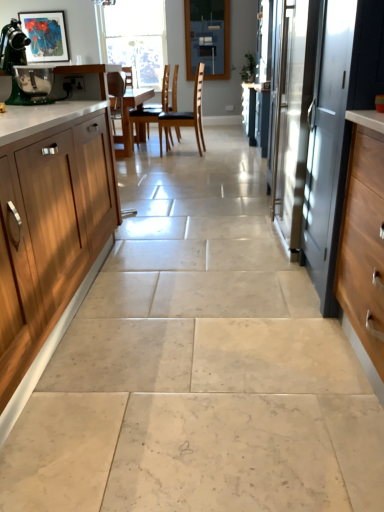
Question: Which direction should I rotate to look at brown leather chair at center, the 2th chair positioned from the right, — up or down?

Choices:
 (A) up
 (B) down

Answer: (A)

Question: Should I look upward or downward to see matte acrylic painting at upper left?

Choices:
 (A) down
 (B) up

Answer: (B)

Question: From a real-world perspective, is black leather chair at center, placed as the 2th chair when sorted from left to right, beneath blue glass window screen at upper center?

Choices:
 (A) yes
 (B) no

Answer: (A)

Question: From a real-world perspective, is black leather chair at center, placed as the 2th chair when sorted from left to right, positioned over blue glass window screen at upper center based on gravity?

Choices:
 (A) no
 (B) yes

Answer: (A)

Question: Is black leather chair at center, which is counted as the first chair, starting from the right, bigger than blue glass window screen at upper center?

Choices:
 (A) no
 (B) yes

Answer: (B)

Question: Is black leather chair at center, which is counted as the first chair, starting from the right, oriented towards blue glass window screen at upper center?

Choices:
 (A) yes
 (B) no

Answer: (B)

Question: From the image's perspective, is black leather chair at center, which is counted as the first chair, starting from the right, above blue glass window screen at upper center?

Choices:
 (A) no
 (B) yes

Answer: (A)

Question: Is blue glass window screen at upper center at the back of black leather chair at center, placed as the 2th chair when sorted from left to right?

Choices:
 (A) yes
 (B) no

Answer: (B)

Question: From the image's perspective, does black leather chair at center, which is counted as the first chair, starting from the right, appear higher than clear glass window at upper center?

Choices:
 (A) yes
 (B) no

Answer: (B)

Question: From a real-world perspective, is black leather chair at center, placed as the 2th chair when sorted from left to right, physically above clear glass window at upper center?

Choices:
 (A) yes
 (B) no

Answer: (B)

Question: Does black leather chair at center, which is counted as the first chair, starting from the right, appear on the left side of clear glass window at upper center?

Choices:
 (A) no
 (B) yes

Answer: (A)

Question: Is black leather chair at center, placed as the 2th chair when sorted from left to right, wider than clear glass window at upper center?

Choices:
 (A) yes
 (B) no

Answer: (A)

Question: Can you confirm if black leather chair at center, which is counted as the first chair, starting from the right, is smaller than clear glass window at upper center?

Choices:
 (A) no
 (B) yes

Answer: (B)

Question: Considering the relative sizes of black leather chair at center, which is counted as the first chair, starting from the right, and clear glass window at upper center in the image provided, is black leather chair at center, which is counted as the first chair, starting from the right, taller than clear glass window at upper center?

Choices:
 (A) no
 (B) yes

Answer: (A)

Question: Are satin silver screen door at right and blue glass window screen at upper center far apart?

Choices:
 (A) yes
 (B) no

Answer: (A)